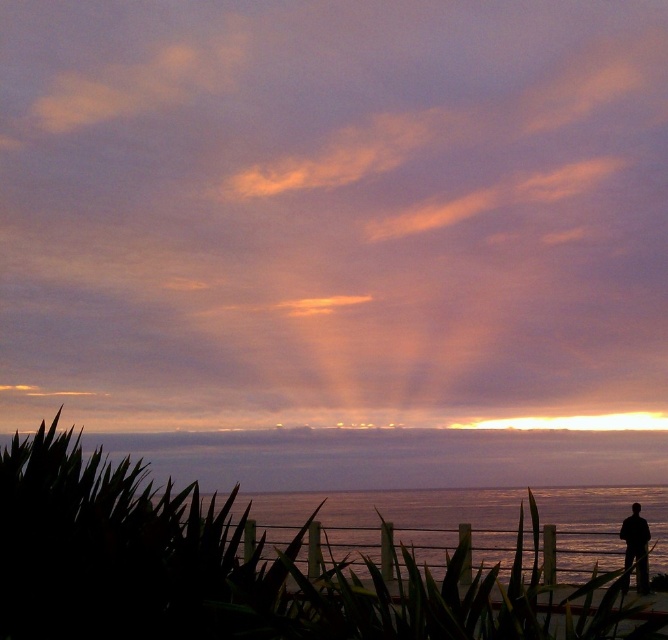
Question: In this image, where is purple matte cloud at upper center located relative to silhouette figure at lower right?

Choices:
 (A) above
 (B) below

Answer: (A)

Question: Which point appears farthest from the camera in this image?

Choices:
 (A) (629, 502)
 (B) (329, 4)
 (C) (637, 545)

Answer: (A)

Question: Is purple matte cloud at upper center smaller than silhouette figure at lower right?

Choices:
 (A) yes
 (B) no

Answer: (B)

Question: Which point is closer to the camera taking this photo?

Choices:
 (A) (232, 344)
 (B) (637, 541)

Answer: (A)

Question: Can you confirm if purple matte cloud at upper center is positioned to the left of silvery water at lower right?

Choices:
 (A) no
 (B) yes

Answer: (B)

Question: Considering the real-world distances, which object is closest to the purple matte cloud at upper center?

Choices:
 (A) silhouette figure at lower right
 (B) silvery water at lower right

Answer: (B)